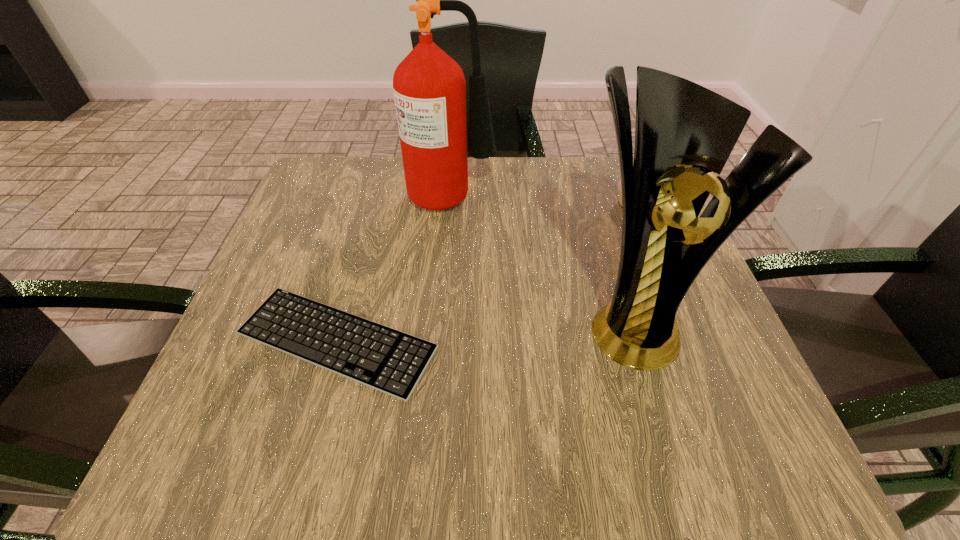
The width and height of the screenshot is (960, 540). I want to click on object that is the second nearest to the fire extinguisher, so click(x=380, y=357).

This screenshot has width=960, height=540. In order to click on vacant space that satisfies the following two spatial constraints: 1. on the back side of the cupcake; 2. at the nozzle of the fire extinguisher in this screenshot , I will do `click(630, 194)`.

This screenshot has width=960, height=540. I want to click on free spot that satisfies the following two spatial constraints: 1. at the nozzle of the fire extinguisher; 2. on the back side of the third tallest object, so click(x=452, y=204).

Image resolution: width=960 pixels, height=540 pixels. I want to click on vacant region that satisfies the following two spatial constraints: 1. at the nozzle of the second shortest object; 2. on the right side of the fire extinguisher, so click(x=452, y=204).